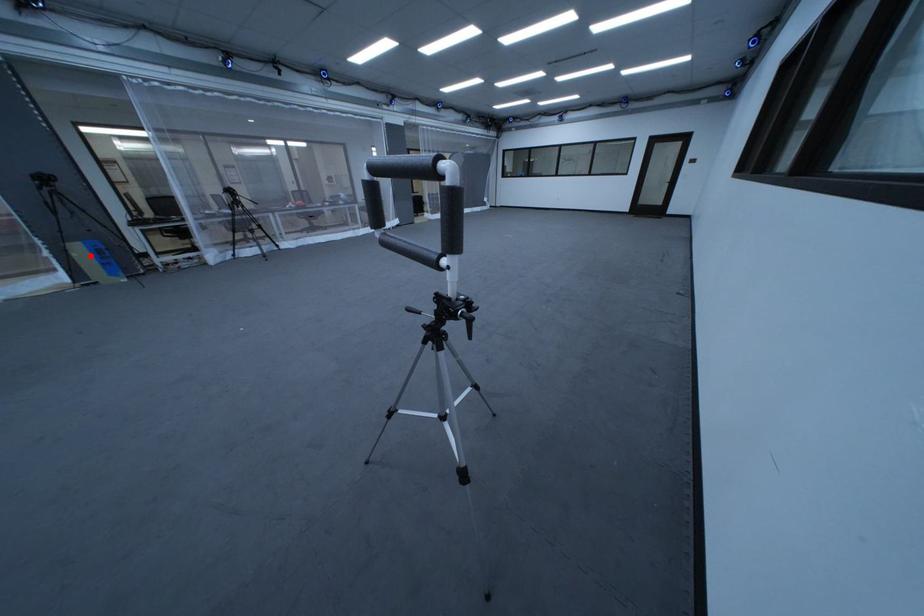
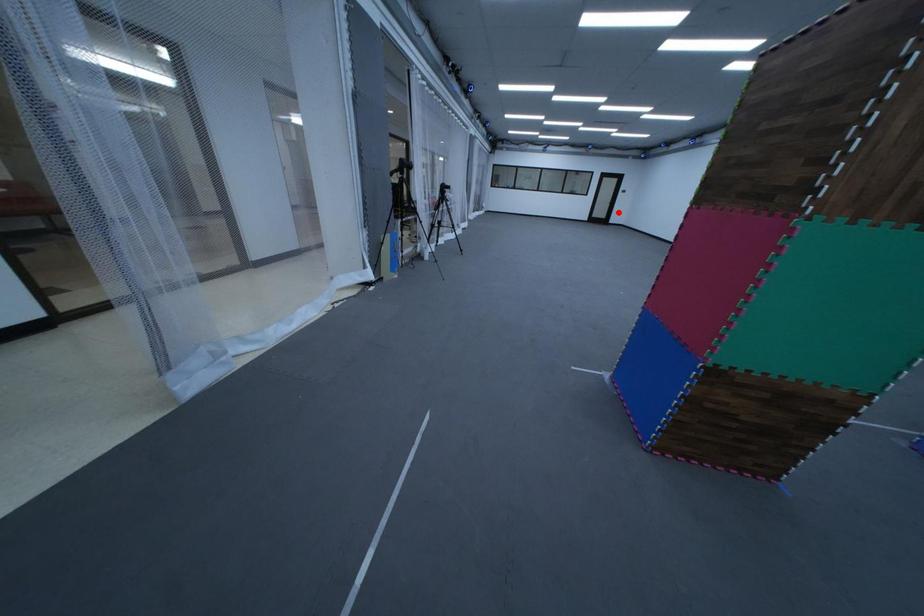
I am providing you with two images of the same scene from different viewpoints. A red point is marked on the first image and another point is marked on the second image. Does the point marked in image1 correspond to the same location as the one in image2?

No